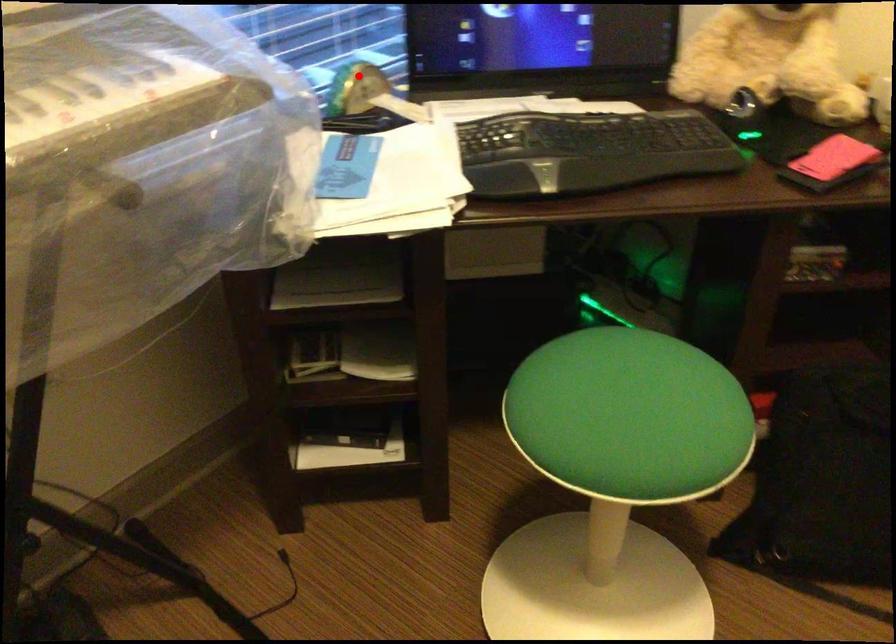
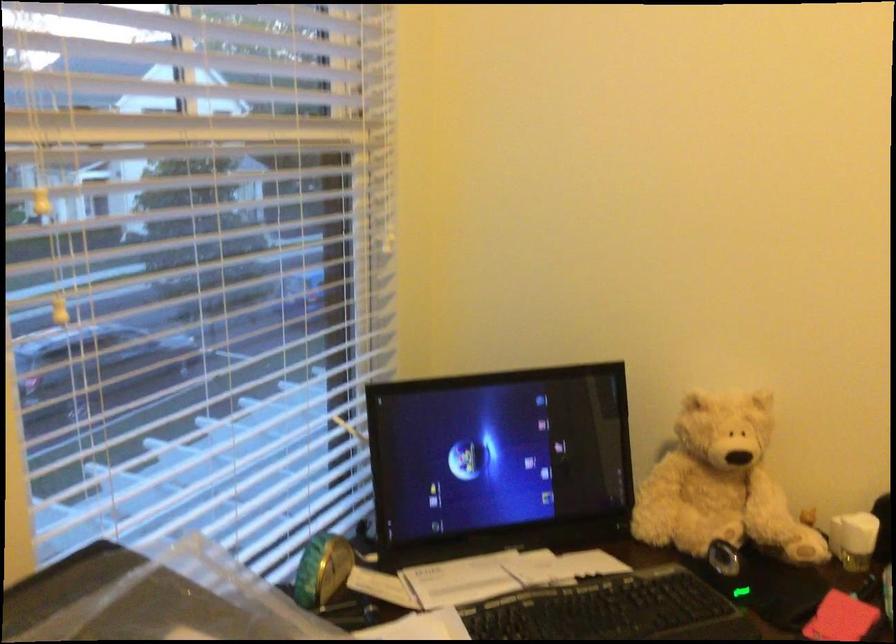
Question: I am providing you with two images of the same scene from different viewpoints. In image1, a red point is highlighted. Considering the same 3D point in image2, which of the following is correct?

Choices:
 (A) It is closer
 (B) It is farther

Answer: (A)